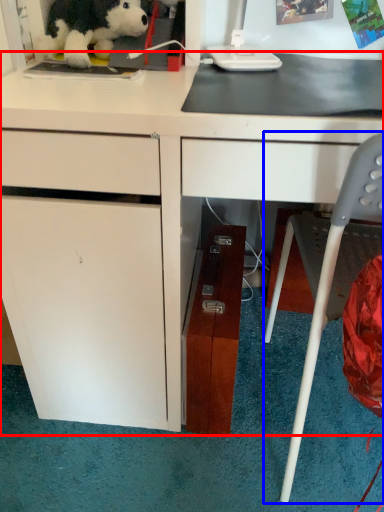
Question: Which of the following is the closest to the observer, desk (highlighted by a red box) or chair (highlighted by a blue box)?

Choices:
 (A) desk
 (B) chair

Answer: (B)